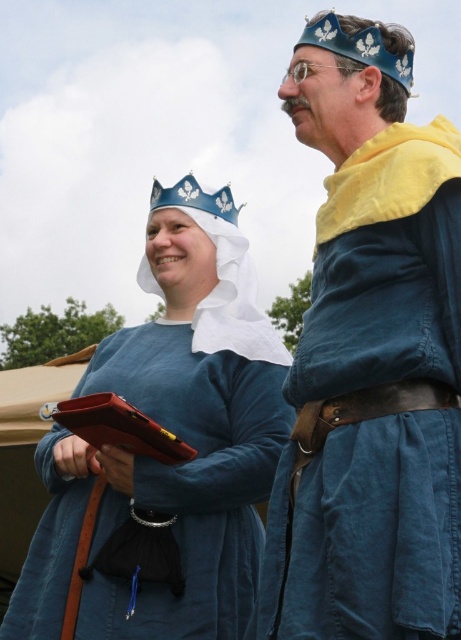
Is point (218, 403) farther from viewer compared to point (220, 282)?

No, (218, 403) is closer to viewer.

Does blue linen dress at center have a smaller size compared to white fabric headdress at center?

No.

Describe the element at coordinates (163, 464) in the screenshot. I see `blue linen dress at center` at that location.

You are a GUI agent. You are given a task and a screenshot of the screen. Output one action in this format:
    pyautogui.click(x=<x>, y=<y>)
    Task: Click on the blue linen dress at center
    
    Given the screenshot: What is the action you would take?
    pyautogui.click(x=163, y=464)

Does white fabric headdress at center have a greater width compared to blue metallic crown at upper center?

No.

Is white fabric headdress at center positioned before blue metallic crown at upper center?

No, it is behind blue metallic crown at upper center.

At what (x,y) coordinates should I click in order to perform the action: click on white fabric headdress at center. Please return your answer as a coordinate pair (x, y). The image size is (461, 640). Looking at the image, I should click on (224, 276).

Where is `white fabric headdress at center`? white fabric headdress at center is located at coordinates (224, 276).

Does blue linen tunic at center have a greater width compared to blue metallic crown at upper center?

Yes, blue linen tunic at center is wider than blue metallic crown at upper center.

Does blue linen tunic at center appear on the right side of blue metallic crown at upper center?

Correct, you'll find blue linen tunic at center to the right of blue metallic crown at upper center.

Is point (409, 157) less distant than point (206, 196)?

Yes, point (409, 157) is in front of point (206, 196).

The width and height of the screenshot is (461, 640). In order to click on blue linen tunic at center in this screenshot , I will do `click(371, 358)`.